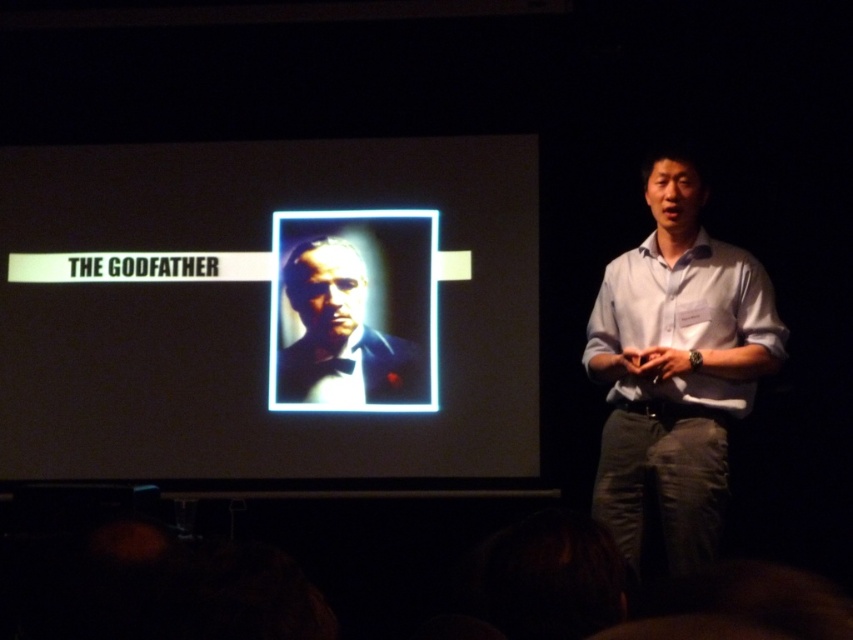
Based on the scene description, where is the matte black frame at center located in terms of coordinates?

The matte black frame at center is located at point coordinates of [270,310].

You are an attendee at the presentation. You notice two items at the center of the stage. One is the white shirt at center and the other is the matte black suit at center. Which item is located lower in the image?

The white shirt at center is positioned under the matte black suit at center, so it is located lower in the image.

You are a photographer trying to capture a clear shot of the matte black frame at center during the presentation. The camera you are using has a minimum focusing distance of 10 feet. Can you take a clear photo without moving the camera?

The matte black frame at center and camera are 12.35 feet apart. Since the minimum focusing distance is 10 feet, the camera can focus on the matte black frame at center as the distance is within the required range. Therefore, you can take a clear photo without moving the camera.